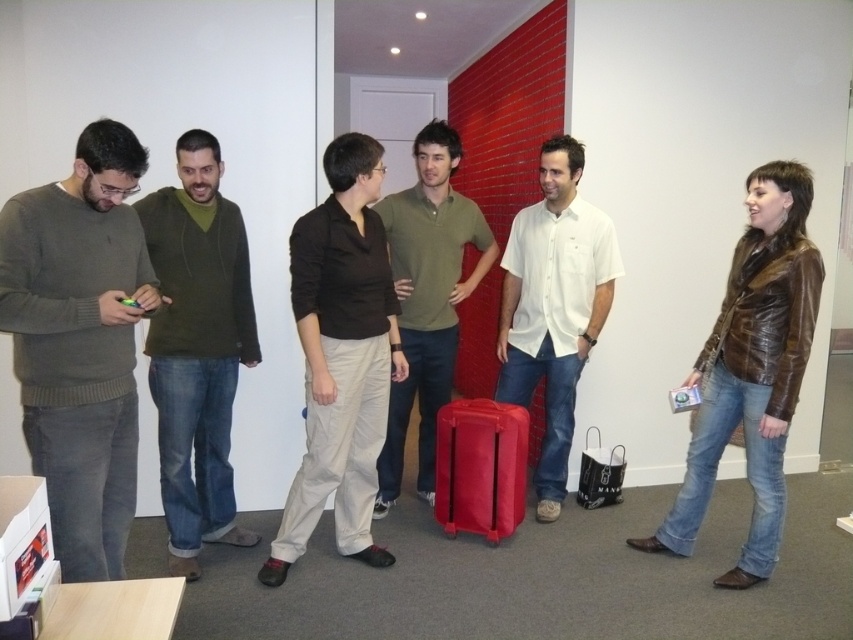
Between matte brown shirt at center and matte red suitcase at center, which one has less height?

Standing shorter between the two is matte red suitcase at center.

From the picture: Does matte brown shirt at center have a lesser width compared to matte red suitcase at center?

In fact, matte brown shirt at center might be wider than matte red suitcase at center.

Is point (343, 419) positioned after point (469, 528)?

That is False.

The image size is (853, 640). I want to click on matte brown shirt at center, so click(x=341, y=356).

Is the position of matte brown shirt at center more distant than that of white cotton shirt at center?

No, it is not.

Is point (294, 275) closer to viewer compared to point (515, 236)?

Yes, point (294, 275) is closer to viewer.

Is point (337, 458) more distant than point (544, 316)?

No.

This screenshot has width=853, height=640. In order to click on matte brown shirt at center in this screenshot , I will do `click(341, 356)`.

Is matte brown shirt at center thinner than brown leather jacket at right?

No, matte brown shirt at center is not thinner than brown leather jacket at right.

Which is more to the left, matte brown shirt at center or brown leather jacket at right?

matte brown shirt at center

What do you see at coordinates (341, 356) in the screenshot? The width and height of the screenshot is (853, 640). I see `matte brown shirt at center` at bounding box center [341, 356].

Where is `matte brown shirt at center`? The width and height of the screenshot is (853, 640). matte brown shirt at center is located at coordinates 341,356.